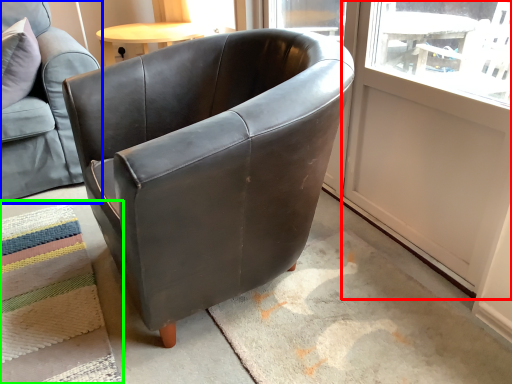
Question: Considering the real-world distances, which object is closest to screen door (highlighted by a red box)? chair (highlighted by a blue box) or mat (highlighted by a green box).

Choices:
 (A) chair
 (B) mat

Answer: (B)